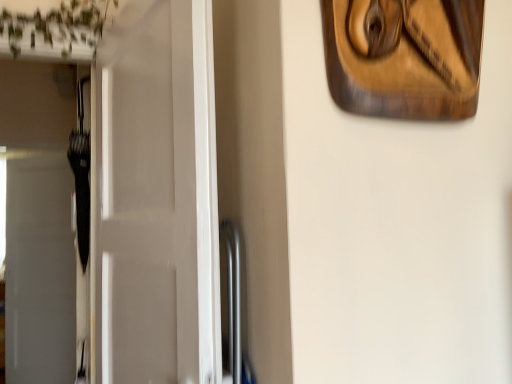
This screenshot has height=384, width=512. Identify the location of wooden carving at upper right. (404, 57).

What do you see at coordinates (404, 57) in the screenshot?
I see `wooden carving at upper right` at bounding box center [404, 57].

At what (x,y) coordinates should I click in order to perform the action: click on white glossy door at left. Please return your answer as a coordinate pair (x, y). The image size is (512, 384). Looking at the image, I should click on (155, 198).

Describe the element at coordinates (155, 198) in the screenshot. I see `white glossy door at left` at that location.

Locate an element on the screen. The image size is (512, 384). wooden carving at upper right is located at coordinates (404, 57).

Considering the positions of objects wooden carving at upper right and white glossy door at left in the image provided, who is more to the right, wooden carving at upper right or white glossy door at left?

wooden carving at upper right.

Considering the relative positions of wooden carving at upper right and white glossy door at left in the image provided, is wooden carving at upper right in front of white glossy door at left?

Yes.

Which point is more forward, (382, 27) or (164, 334)?

The point (382, 27) is closer to the camera.

From the image's perspective, which one is positioned lower, wooden carving at upper right or white glossy door at left?

From the image's view, white glossy door at left is below.

From the picture: From a real-world perspective, is wooden carving at upper right located higher than white glossy door at left?

Yes, from a real-world perspective, wooden carving at upper right is on top of white glossy door at left.

Looking at their sizes, would you say wooden carving at upper right is wider or thinner than white glossy door at left?

In the image, wooden carving at upper right appears to be more narrow than white glossy door at left.

Between wooden carving at upper right and white glossy door at left, which one has less height?

Standing shorter between the two is wooden carving at upper right.

Which of these two, wooden carving at upper right or white glossy door at left, is smaller?

wooden carving at upper right.

Does wooden carving at upper right contain white glossy door at left?

Definitely not — white glossy door at left is not inside wooden carving at upper right.

Is wooden carving at upper right not near white glossy door at left?

No.

Is wooden carving at upper right oriented towards white glossy door at left?

No, wooden carving at upper right is not oriented towards white glossy door at left.

How distant is wooden carving at upper right from white glossy door at left?

wooden carving at upper right is 20.23 inches from white glossy door at left.

This screenshot has height=384, width=512. In order to click on door behind the wooden carving at upper right in this screenshot , I will do `click(155, 198)`.

Considering the relative positions of white glossy door at left and wooden carving at upper right in the image provided, is white glossy door at left to the left or to the right of wooden carving at upper right?

In the image, white glossy door at left appears on the left side of wooden carving at upper right.

Is white glossy door at left in front of or behind wooden carving at upper right in the image?

white glossy door at left is positioned farther from the viewer than wooden carving at upper right.

Does point (162, 291) lie behind point (423, 42)?

Yes, point (162, 291) is behind point (423, 42).

From the image's perspective, who appears lower, white glossy door at left or wooden carving at upper right?

white glossy door at left appears lower in the image.

From a real-world perspective, which is physically below, white glossy door at left or wooden carving at upper right?

white glossy door at left.

Considering the relative sizes of white glossy door at left and wooden carving at upper right in the image provided, is white glossy door at left thinner than wooden carving at upper right?

No.

Between white glossy door at left and wooden carving at upper right, which one has less height?

wooden carving at upper right is shorter.

Between white glossy door at left and wooden carving at upper right, which one has smaller size?

With smaller size is wooden carving at upper right.

Looking at this image, would you say white glossy door at left is inside or outside wooden carving at upper right?

white glossy door at left is not enclosed by wooden carving at upper right.

Would you consider white glossy door at left to be distant from wooden carving at upper right?

No, white glossy door at left is not far away from wooden carving at upper right.

Is white glossy door at left positioned with its back to wooden carving at upper right?

white glossy door at left is not turned away from wooden carving at upper right.

What's the angular difference between white glossy door at left and wooden carving at upper right's facing directions?

75.2 degrees.

Where is `door that appears below the wooden carving at upper right (from the image's perspective)`? door that appears below the wooden carving at upper right (from the image's perspective) is located at coordinates (155, 198).

In the image, there is a wooden carving at upper right. Where is `door below it (from the image's perspective)`? door below it (from the image's perspective) is located at coordinates (155, 198).

Where is `door that is on the left side of wooden carving at upper right`? Image resolution: width=512 pixels, height=384 pixels. door that is on the left side of wooden carving at upper right is located at coordinates (155, 198).